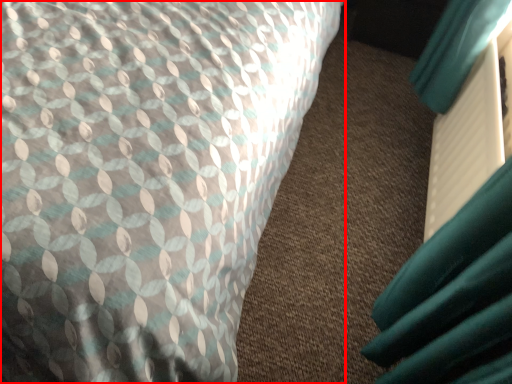
Question: From the image's perspective, what is the correct spatial positioning of bed (annotated by the red box) in reference to paperback book?

Choices:
 (A) below
 (B) above

Answer: (B)